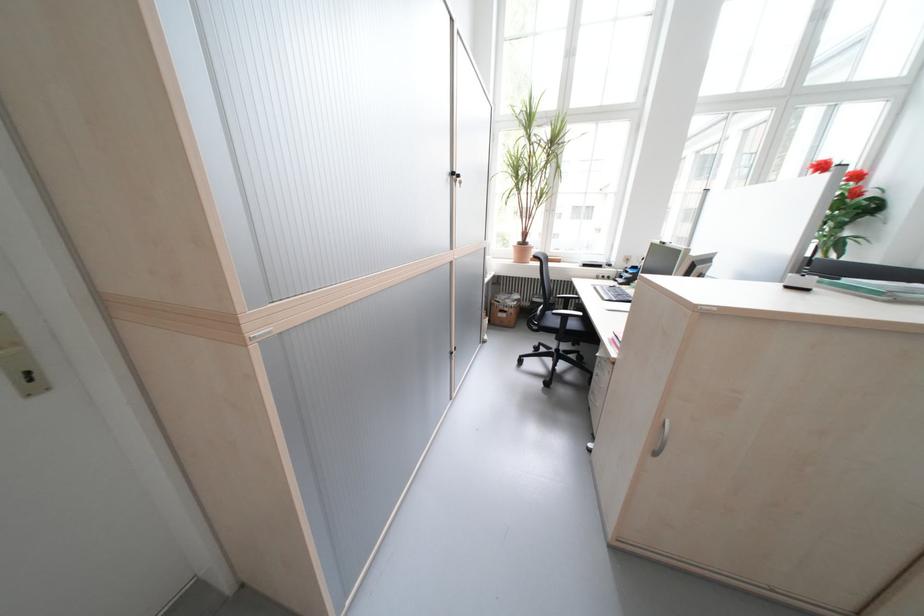
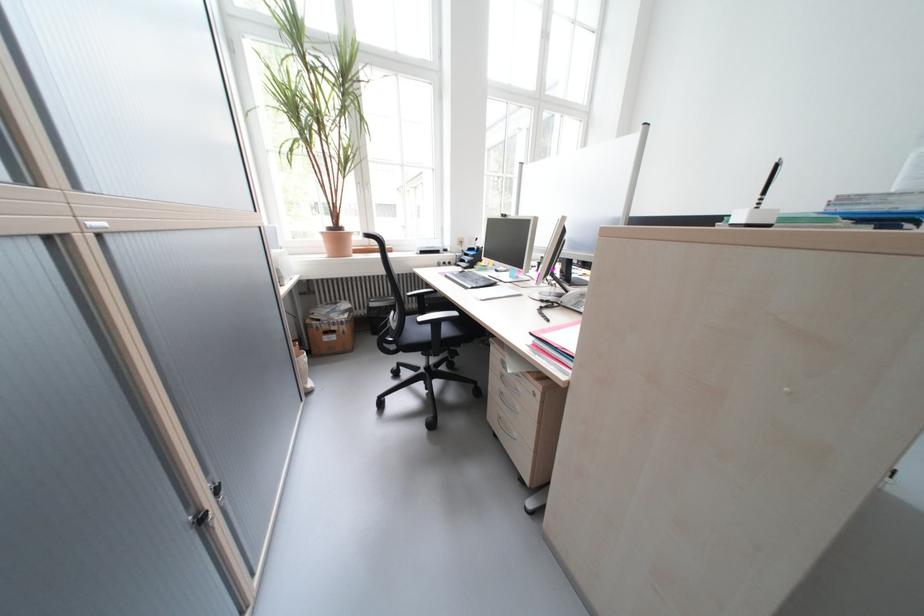
Find the pixel in the second image that matches point (529, 245) in the first image.

(339, 231)